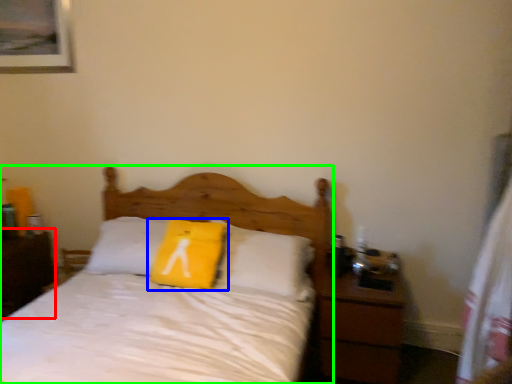
Question: Which object is positioned farthest from nightstand (highlighted by a red box)? Select from pillow (highlighted by a blue box) and bed (highlighted by a green box).

Choices:
 (A) pillow
 (B) bed

Answer: (A)